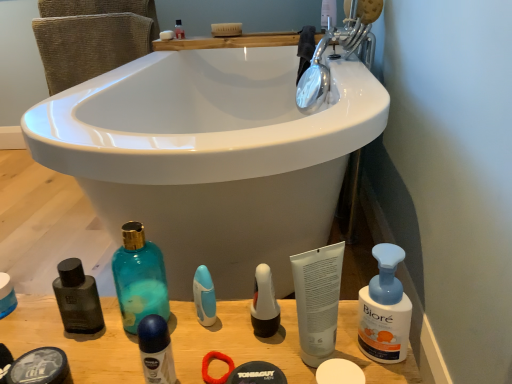
Find the location of a particular element. vacant region in front of blue plastic toothbrush at center, arranged as the 5th toiletry when viewed from the front is located at coordinates (209, 354).